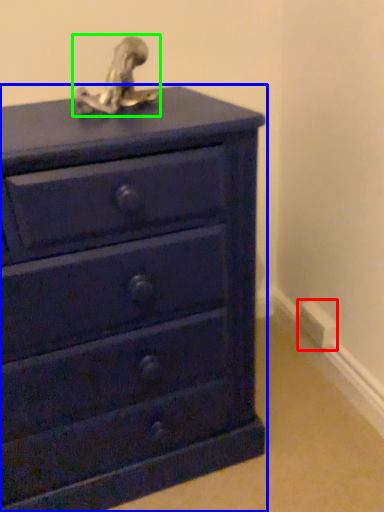
Question: Based on their relative distances, which object is nearer to electric outlet (highlighted by a red box)? Choose from chest of drawers (highlighted by a blue box) and sculpture (highlighted by a green box).

Choices:
 (A) chest of drawers
 (B) sculpture

Answer: (A)